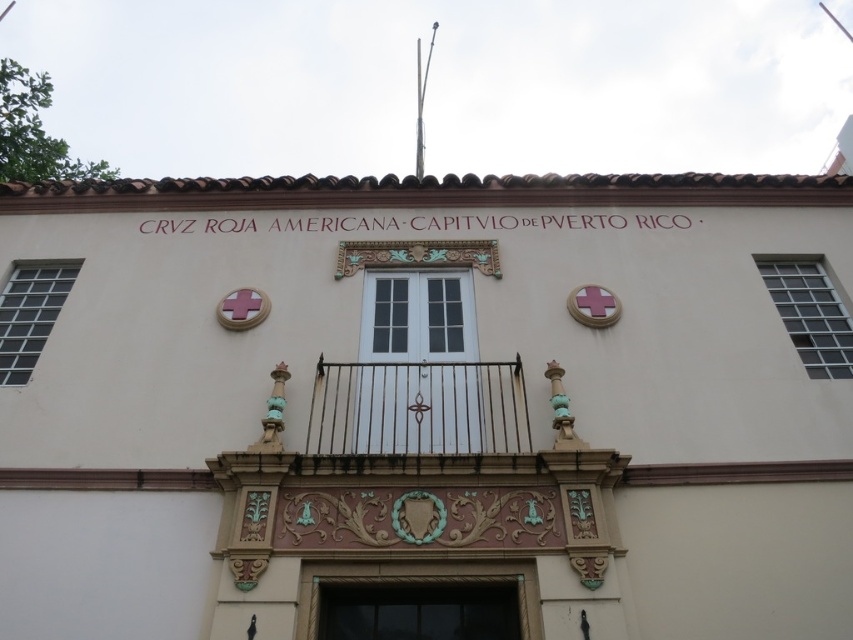
Between white painted wood door at center and brown textured door at center, which one is positioned lower?

brown textured door at center

Is white painted wood door at center shorter than brown textured door at center?

No, white painted wood door at center is not shorter than brown textured door at center.

What do you see at coordinates (416, 365) in the screenshot? I see `white painted wood door at center` at bounding box center [416, 365].

Identify the location of white painted wood door at center. The height and width of the screenshot is (640, 853). (416, 365).